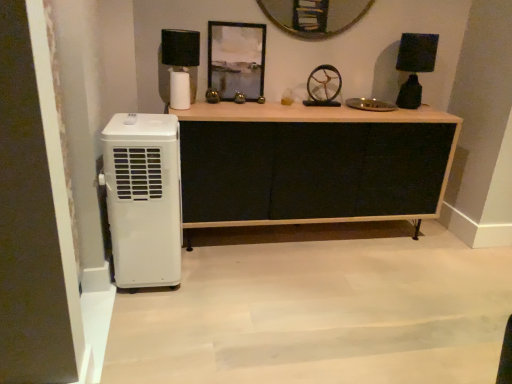
Locate an element on the screen. The image size is (512, 384). free space in front of white plastic air conditioner at left is located at coordinates [x=156, y=316].